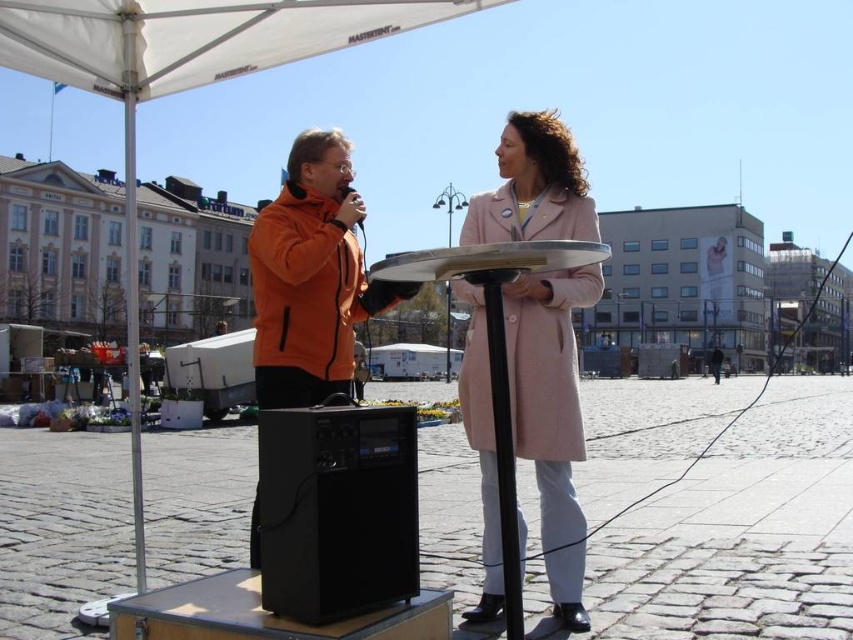
You are a photographer positioned at the center of the square. You want to take a photo of the orange fleece jacket at center. Which direction should you point your camera to capture it?

The orange fleece jacket at center is already at the center of the square, so you should point your camera straight ahead to capture it.

You are a photographer trying to capture a clear shot of the orange fleece jacket at left and the matte black microphone at center. Based on their positions, which object should you focus on first if you want to ensure both are in frame without moving the camera?

The orange fleece jacket at left is located below the matte black microphone at center, so focusing on the matte black microphone at center first will ensure both are in frame since the jacket is positioned lower.